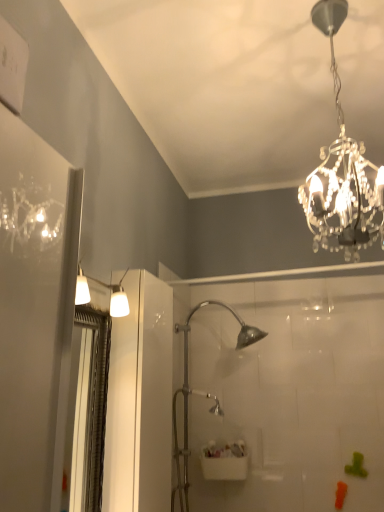
Question: Would you say clear crystal chandelier at upper right is inside or outside white plastic sink at center?

Choices:
 (A) inside
 (B) outside

Answer: (B)

Question: In terms of size, does clear crystal chandelier at upper right appear bigger or smaller than white plastic sink at center?

Choices:
 (A) small
 (B) big

Answer: (B)

Question: Considering the real-world distances, which object is farthest from the clear crystal chandelier at upper right?

Choices:
 (A) white plastic sink at center
 (B) clear plastic screen door at left

Answer: (A)

Question: Which object is the closest to the clear crystal chandelier at upper right?

Choices:
 (A) white plastic sink at center
 (B) clear plastic screen door at left

Answer: (B)